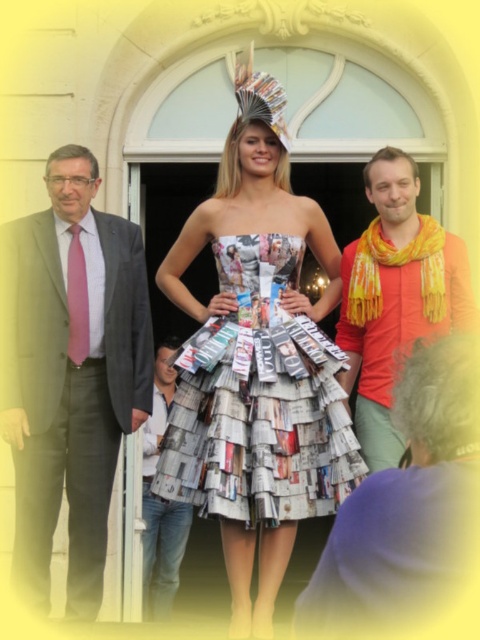
Question: Is pink silk tie at left further to the viewer compared to orange scarf at right?

Choices:
 (A) yes
 (B) no

Answer: (A)

Question: Which of the following is the closest to the observer?

Choices:
 (A) (148, 513)
 (B) (215, 513)
 (C) (46, 371)

Answer: (B)

Question: Considering the real-world distances, which object is closest to the pink silk tie at left?

Choices:
 (A) printed newspaper dress at center
 (B) white cotton shirt at center
 (C) orange scarf at right

Answer: (A)

Question: Which of the following is the farthest from the observer?

Choices:
 (A) (143, 428)
 (B) (431, 227)
 (C) (300, 436)

Answer: (A)

Question: From the image, what is the correct spatial relationship of pink silk tie at left in relation to orange scarf at right?

Choices:
 (A) below
 (B) above

Answer: (A)

Question: Is pink silk tie at left behind white cotton shirt at center?

Choices:
 (A) no
 (B) yes

Answer: (A)